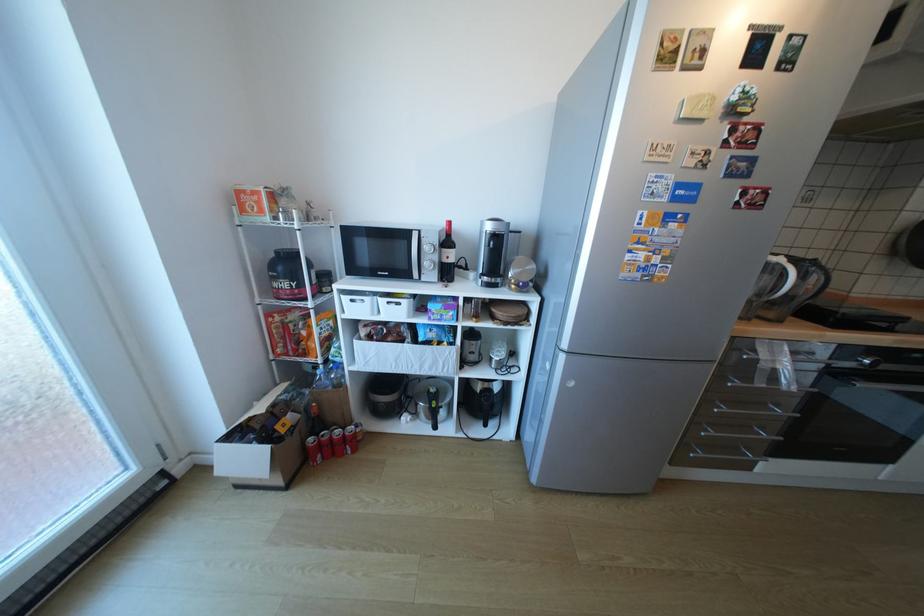
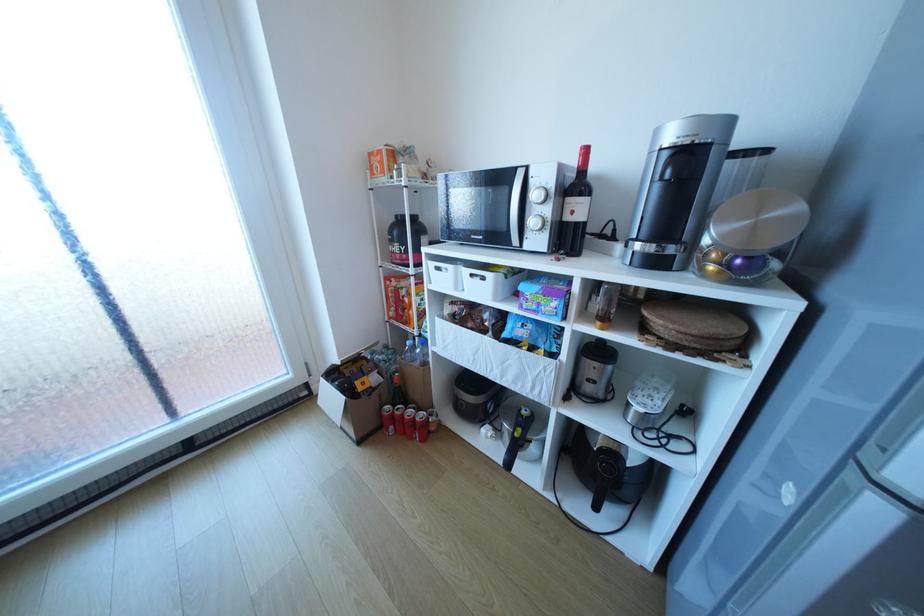
The point at (434, 264) is marked in the first image. Where is the corresponding point in the second image?

(541, 222)